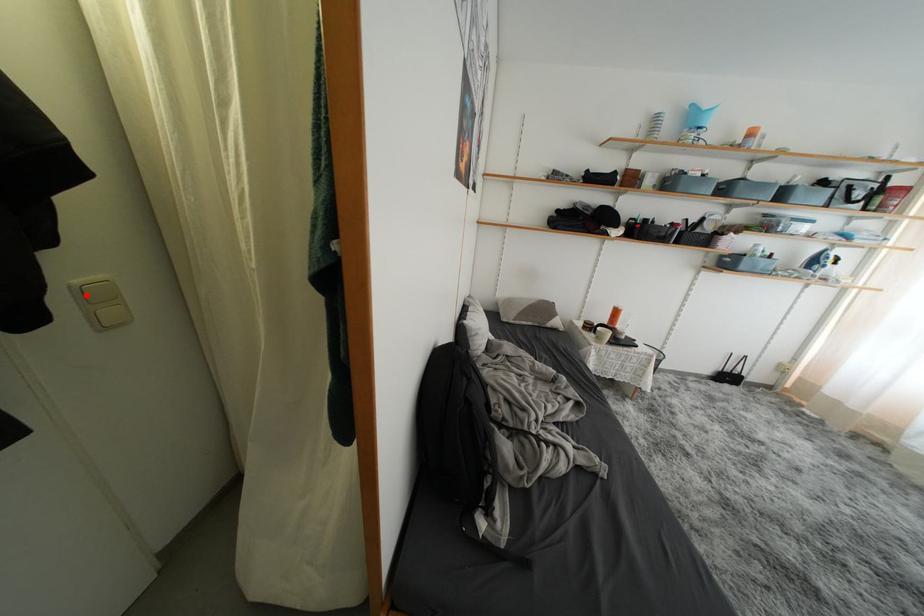
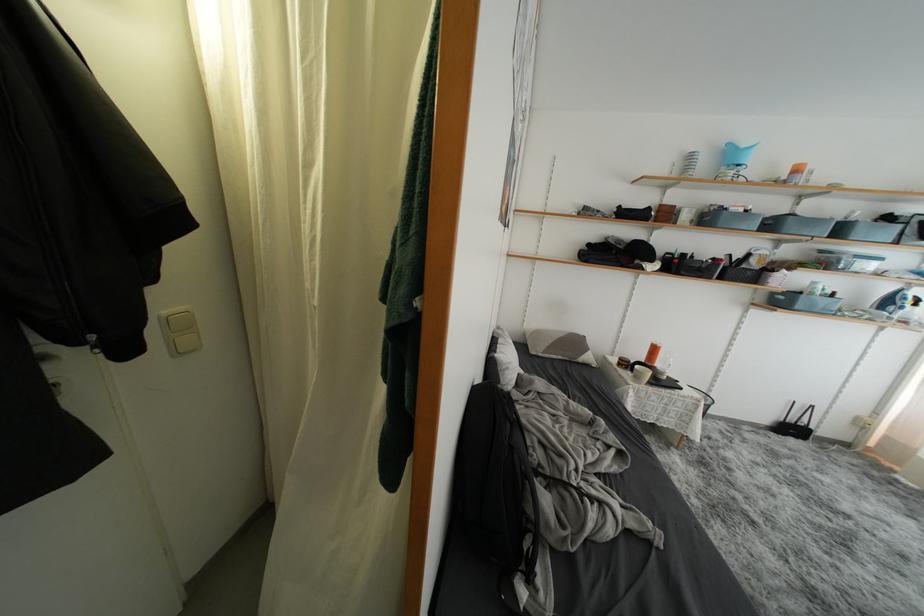
Where in the second image is the point corresponding to the highlighted location from the first image?

(172, 325)